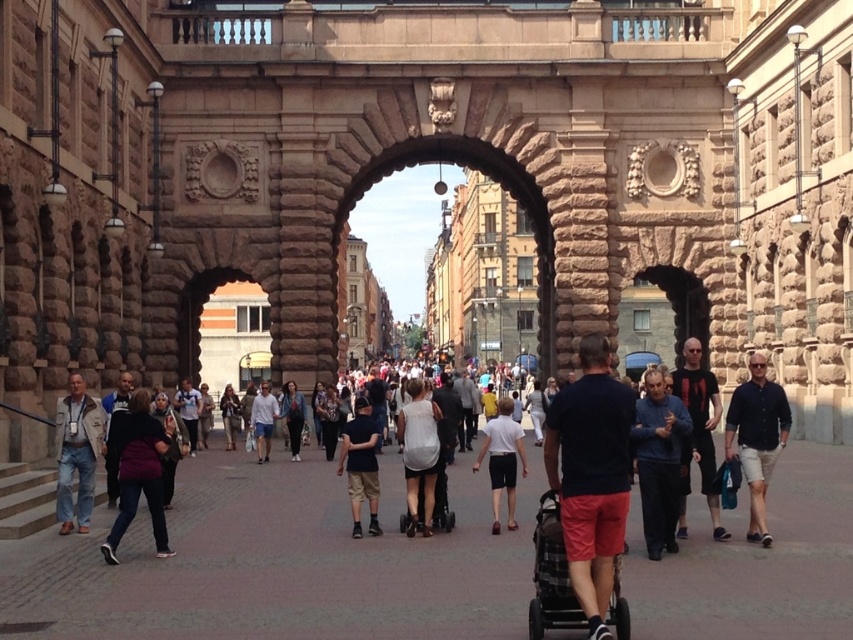
Question: Which point is farther to the camera?

Choices:
 (A) (285, 392)
 (B) (412, 488)

Answer: (A)

Question: Which point is closer to the camera taking this photo?

Choices:
 (A) [x=289, y=428]
 (B) [x=491, y=429]
 (C) [x=679, y=400]

Answer: (C)

Question: Does dark purple sweater at center appear on the right side of white cotton shirt at center?

Choices:
 (A) yes
 (B) no

Answer: (A)

Question: Which object appears farthest from the camera in this image?

Choices:
 (A) dark gray sweater at center
 (B) white cotton shirt at center
 (C) white matte shorts at center
 (D) light brown leather jacket at center

Answer: (D)

Question: Does white matte dress at center appear on the left side of dark gray sweater at center?

Choices:
 (A) no
 (B) yes

Answer: (A)

Question: Does dark purple sweater at center have a smaller size compared to dark blue shirt at center?

Choices:
 (A) no
 (B) yes

Answer: (A)